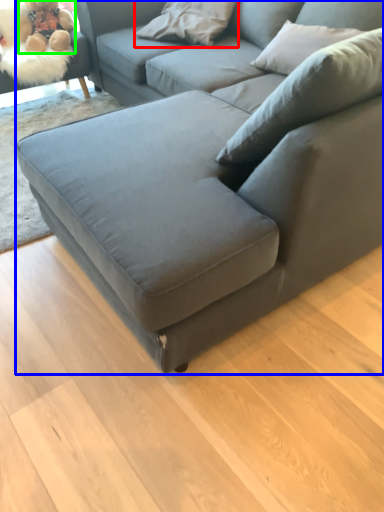
Question: Which is nearer to the pillow (highlighted by a red box)? studio couch (highlighted by a blue box) or toy (highlighted by a green box).

Choices:
 (A) studio couch
 (B) toy

Answer: (B)